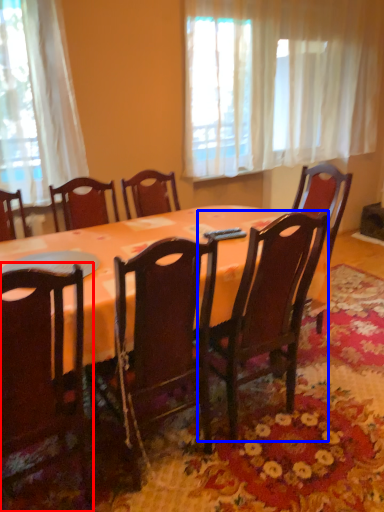
Question: Which object is closer to the camera taking this photo, chair (highlighted by a red box) or chair (highlighted by a blue box)?

Choices:
 (A) chair
 (B) chair

Answer: (A)